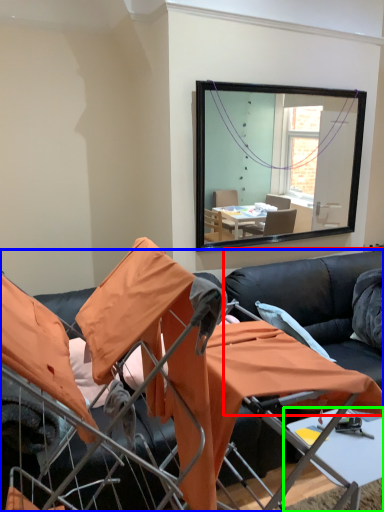
Question: Which is nearer to the couch (highlighted by a red box)? studio couch (highlighted by a blue box) or table (highlighted by a green box).

Choices:
 (A) studio couch
 (B) table

Answer: (B)